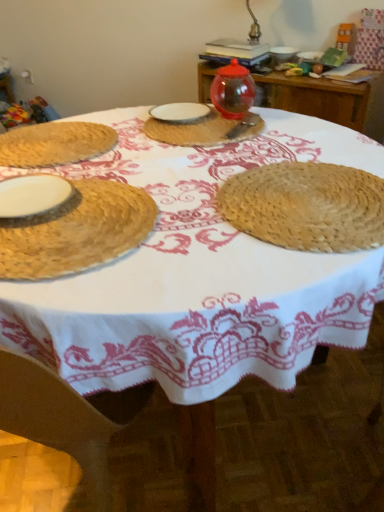
Where is `free point above natural straw placemat at left, which is the 5th tableware in back-to-front order (from a real-world perspective)`? This screenshot has width=384, height=512. free point above natural straw placemat at left, which is the 5th tableware in back-to-front order (from a real-world perspective) is located at coordinates (50, 219).